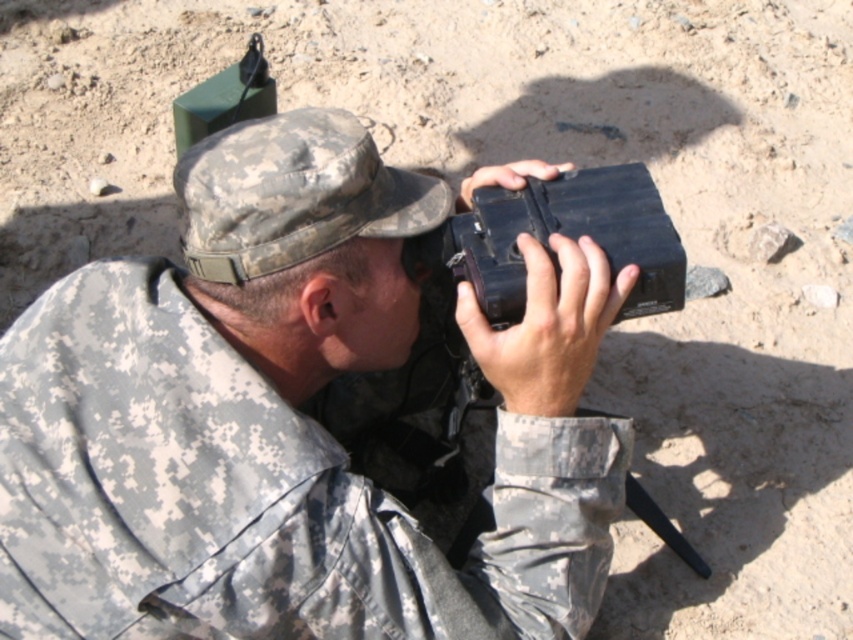
Question: Where is matte black case at upper center located in relation to black matte camera at center in the image?

Choices:
 (A) below
 (B) above

Answer: (A)

Question: Does matte black case at upper center appear on the left side of black matte camera at center?

Choices:
 (A) yes
 (B) no

Answer: (A)

Question: Is matte black case at upper center bigger than black matte camera at center?

Choices:
 (A) yes
 (B) no

Answer: (A)

Question: Which of the following is the closest to the observer?

Choices:
 (A) (453, 593)
 (B) (518, 264)

Answer: (A)